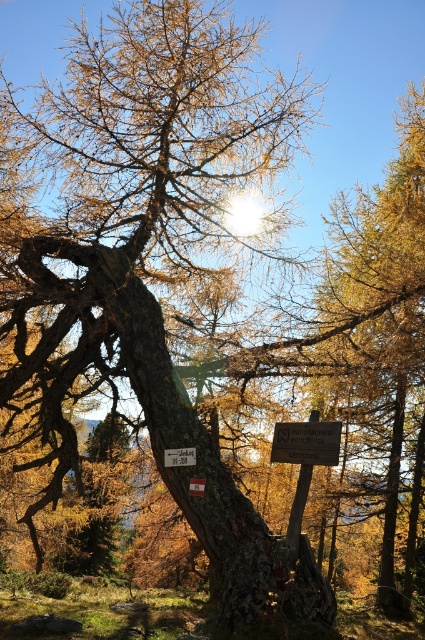
Question: From the image, what is the correct spatial relationship of white plastic sign at center in relation to brown wooden sign at center?

Choices:
 (A) right
 (B) left

Answer: (B)

Question: Can you confirm if wooden sign at center is bigger than brown wooden sign at center?

Choices:
 (A) no
 (B) yes

Answer: (B)

Question: Which point is closer to the camera taking this photo?

Choices:
 (A) (175, 458)
 (B) (195, 486)

Answer: (B)

Question: Among these objects, which one is nearest to the camera?

Choices:
 (A) wooden sign at center
 (B) white plastic sign at center

Answer: (A)

Question: Which point is farther from the camera taking this photo?

Choices:
 (A) (336, 458)
 (B) (183, 452)

Answer: (B)

Question: Can you confirm if white plastic sign at center is bigger than brown wooden sign at center?

Choices:
 (A) yes
 (B) no

Answer: (A)